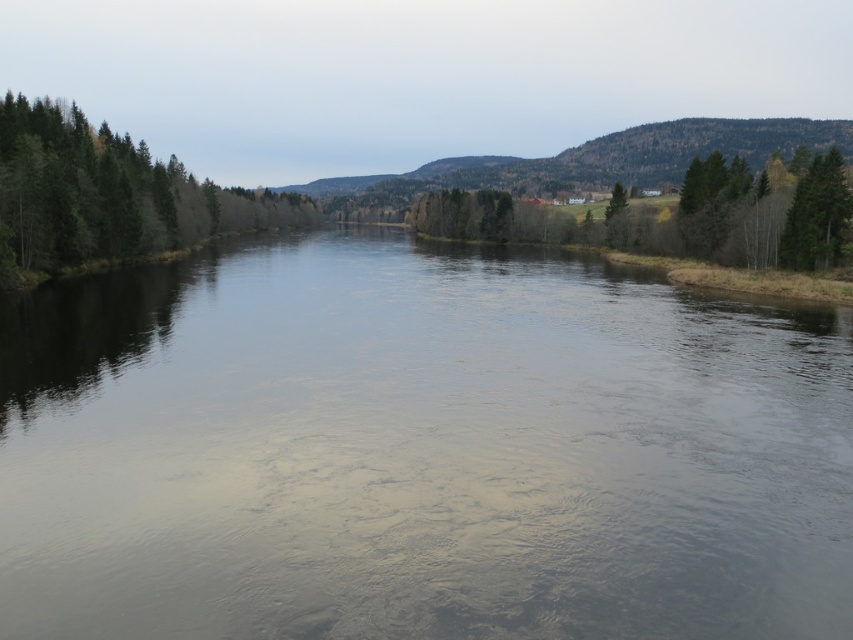
Which of these two, green matte trees at left or green matte tree at right, stands shorter?

green matte tree at right

Can you confirm if green matte trees at left is taller than green matte tree at right?

Yes, green matte trees at left is taller than green matte tree at right.

Image resolution: width=853 pixels, height=640 pixels. Describe the element at coordinates (108, 196) in the screenshot. I see `green matte trees at left` at that location.

At what (x,y) coordinates should I click in order to perform the action: click on green matte trees at left. Please return your answer as a coordinate pair (x, y). This screenshot has height=640, width=853. Looking at the image, I should click on (108, 196).

Does smooth water at center appear under green matte tree at right?

Yes.

Is point (323, 417) positioned in front of point (804, 224)?

Yes, point (323, 417) is in front of point (804, 224).

At what (x,y) coordinates should I click in order to perform the action: click on smooth water at center. Please return your answer as a coordinate pair (x, y). Looking at the image, I should click on (418, 451).

From the picture: Is smooth water at center shorter than green matte trees at left?

Yes.

Measure the distance between smooth water at center and camera.

smooth water at center and camera are 12.24 meters apart from each other.

Locate an element on the screen. smooth water at center is located at coordinates (418, 451).

At what (x,y) coordinates should I click in order to perform the action: click on smooth water at center. Please return your answer as a coordinate pair (x, y). Looking at the image, I should click on (418, 451).